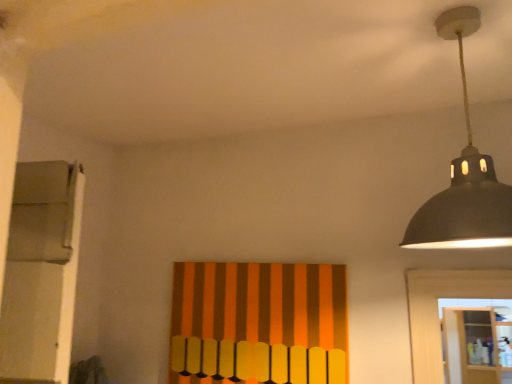
Question: From a real-world perspective, does matte black lampshade at upper right stand above wooden cabinet at lower right?

Choices:
 (A) no
 (B) yes

Answer: (B)

Question: Is matte black lampshade at upper right not near wooden cabinet at lower right?

Choices:
 (A) no
 (B) yes

Answer: (B)

Question: Is matte black lampshade at upper right to the right of wooden cabinet at lower right from the viewer's perspective?

Choices:
 (A) yes
 (B) no

Answer: (B)

Question: Is matte black lampshade at upper right bigger than wooden cabinet at lower right?

Choices:
 (A) yes
 (B) no

Answer: (B)

Question: Is the depth of matte black lampshade at upper right greater than that of wooden cabinet at lower right?

Choices:
 (A) no
 (B) yes

Answer: (A)

Question: Is matte black lampshade at upper right in front of wooden cabinet at lower right?

Choices:
 (A) yes
 (B) no

Answer: (A)

Question: Is wooden cabinet at lower right at the right side of orange striped fabric at center?

Choices:
 (A) no
 (B) yes

Answer: (B)

Question: Does wooden cabinet at lower right touch orange striped fabric at center?

Choices:
 (A) yes
 (B) no

Answer: (B)

Question: From the image's perspective, is wooden cabinet at lower right under orange striped fabric at center?

Choices:
 (A) yes
 (B) no

Answer: (A)

Question: Does wooden cabinet at lower right have a greater width compared to orange striped fabric at center?

Choices:
 (A) no
 (B) yes

Answer: (B)

Question: Considering the relative sizes of wooden cabinet at lower right and orange striped fabric at center in the image provided, is wooden cabinet at lower right taller than orange striped fabric at center?

Choices:
 (A) no
 (B) yes

Answer: (B)

Question: From a real-world perspective, is wooden cabinet at lower right over orange striped fabric at center?

Choices:
 (A) yes
 (B) no

Answer: (B)

Question: Is wooden cabinet at lower right to the right of matte black lampshade at upper right from the viewer's perspective?

Choices:
 (A) no
 (B) yes

Answer: (B)